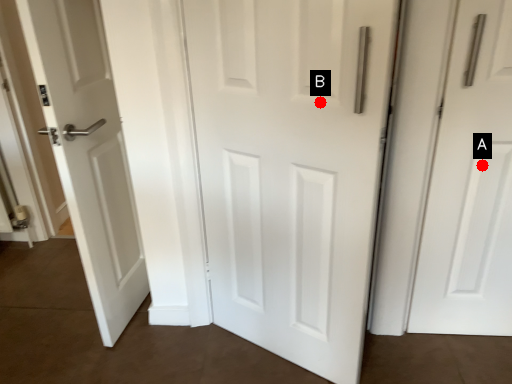
Question: Two points are circled on the image, labeled by A and B beside each circle. Which point is closer to the camera?

Choices:
 (A) A is closer
 (B) B is closer

Answer: (B)